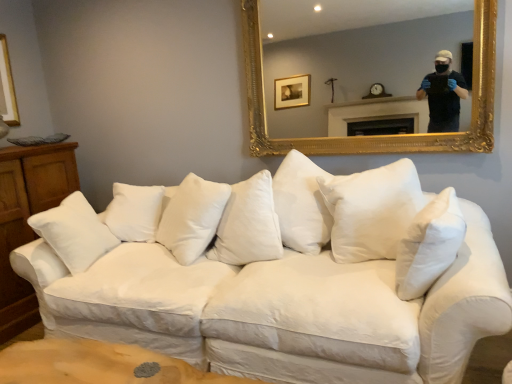
Question: Should I look upward or downward to see white cotton pillow at center, the 2th pillow viewed from the right?

Choices:
 (A) up
 (B) down

Answer: (B)

Question: Does white cotton pillow at center, the 2th pillow viewed from the right, have a greater width compared to white cotton couch at center?

Choices:
 (A) no
 (B) yes

Answer: (A)

Question: From a real-world perspective, is white cotton pillow at center, the 1th pillow positioned from the back, beneath white cotton couch at center?

Choices:
 (A) yes
 (B) no

Answer: (B)

Question: Can you confirm if white cotton pillow at center, which is the 1th pillow from left to right, is taller than white cotton couch at center?

Choices:
 (A) no
 (B) yes

Answer: (A)

Question: Is white cotton pillow at center, the 2th pillow viewed from the right, located outside white cotton couch at center?

Choices:
 (A) yes
 (B) no

Answer: (B)

Question: Can you confirm if white cotton pillow at center, which is the 1th pillow from left to right, is bigger than white cotton couch at center?

Choices:
 (A) no
 (B) yes

Answer: (A)

Question: Is white cotton pillow at center, the 1th pillow positioned from the back, at the left side of white cotton couch at center?

Choices:
 (A) no
 (B) yes

Answer: (B)

Question: Is white cotton pillow at center, the 1th pillow positioned from the back, positioned with its back to gold ornate mirror at upper center?

Choices:
 (A) no
 (B) yes

Answer: (A)

Question: From a real-world perspective, is white cotton pillow at center, which is the 1th pillow from left to right, physically below gold ornate mirror at upper center?

Choices:
 (A) no
 (B) yes

Answer: (B)

Question: Considering the relative sizes of white cotton pillow at center, the 2th pillow viewed from the right, and gold ornate mirror at upper center in the image provided, is white cotton pillow at center, the 2th pillow viewed from the right, smaller than gold ornate mirror at upper center?

Choices:
 (A) yes
 (B) no

Answer: (A)

Question: Is white cotton pillow at center, which is the 1th pillow from left to right, wider than gold ornate mirror at upper center?

Choices:
 (A) no
 (B) yes

Answer: (B)

Question: Is white cotton pillow at center, which is the 1th pillow from left to right, facing towards gold ornate mirror at upper center?

Choices:
 (A) yes
 (B) no

Answer: (B)

Question: From the image's perspective, is white cotton pillow at center, the 1th pillow positioned from the back, below gold ornate mirror at upper center?

Choices:
 (A) yes
 (B) no

Answer: (A)

Question: Considering the relative positions of wooden dresser at left and gold ornate mirror at upper center in the image provided, is wooden dresser at left to the right of gold ornate mirror at upper center from the viewer's perspective?

Choices:
 (A) yes
 (B) no

Answer: (B)